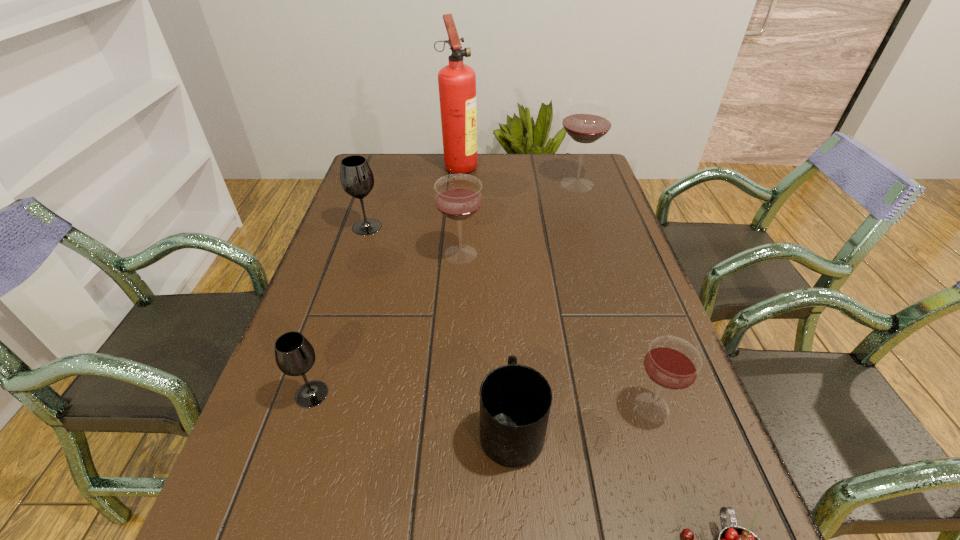
This screenshot has height=540, width=960. Identify the location of black mug. (515, 400).

This screenshot has height=540, width=960. I want to click on free space located 0.310m on the front-facing side of the tallest object, so click(x=568, y=165).

This screenshot has height=540, width=960. I want to click on vacant space located on the left of the tallest wineglass, so click(x=446, y=184).

Where is `vacant area situated on the right of the second smallest red wineglass`? The height and width of the screenshot is (540, 960). vacant area situated on the right of the second smallest red wineglass is located at coordinates coord(528,254).

I want to click on free spot located 0.090m on the right of the second farthest wineglass, so click(414, 227).

Image resolution: width=960 pixels, height=540 pixels. Identify the location of free space located 0.150m on the back of the smallest red wineglass. (626, 329).

Find the location of `vacant space situated on the right of the smaller gray wineglass`. vacant space situated on the right of the smaller gray wineglass is located at coordinates (533, 394).

Where is `free spot located 0.130m on the side of the mug with the handle`? free spot located 0.130m on the side of the mug with the handle is located at coordinates (506, 340).

Find the location of a particular element. The image size is (960, 540). vacant space located on the side of the mug with the handle is located at coordinates (505, 323).

The height and width of the screenshot is (540, 960). Identify the location of vacant space situated on the side of the mug with the handle. (508, 363).